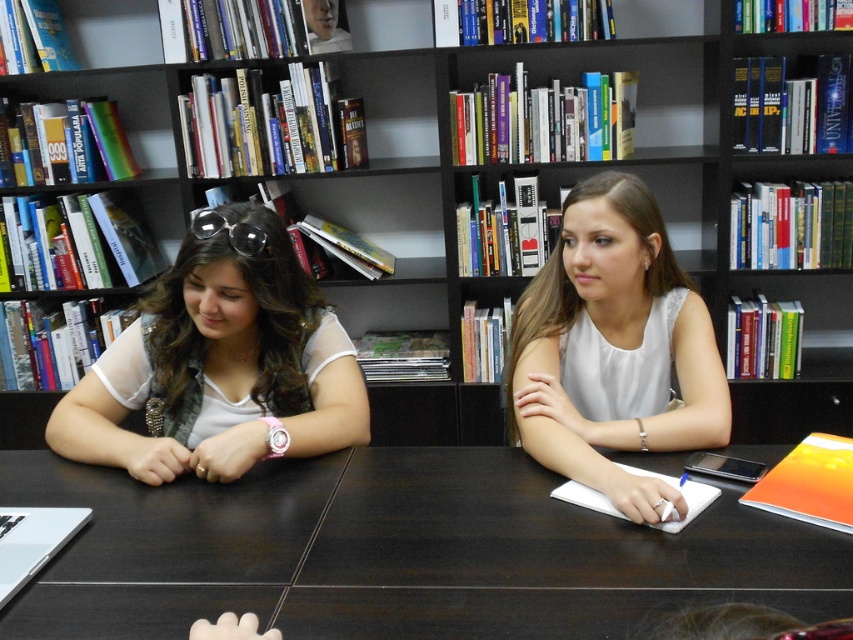
Question: Which point is farther from the camera taking this photo?

Choices:
 (A) (x=149, y=600)
 (B) (x=270, y=419)
 (C) (x=372, y=205)
 (D) (x=590, y=476)

Answer: (C)

Question: Can you confirm if matte white shirt at left is wider than white satin blouse at center?

Choices:
 (A) no
 (B) yes

Answer: (B)

Question: Does black matte bookcase at upper center appear on the left side of matte white shirt at left?

Choices:
 (A) yes
 (B) no

Answer: (B)

Question: Estimate the real-world distances between objects in this image. Which object is closer to the black matte bookcase at upper center?

Choices:
 (A) dark wood table at center
 (B) white satin blouse at center
 (C) matte white shirt at left

Answer: (B)

Question: Which point is farther to the camera?

Choices:
 (A) (251, 224)
 (B) (606, 476)

Answer: (A)

Question: Is black matte bookcase at upper center thinner than white satin blouse at center?

Choices:
 (A) no
 (B) yes

Answer: (A)